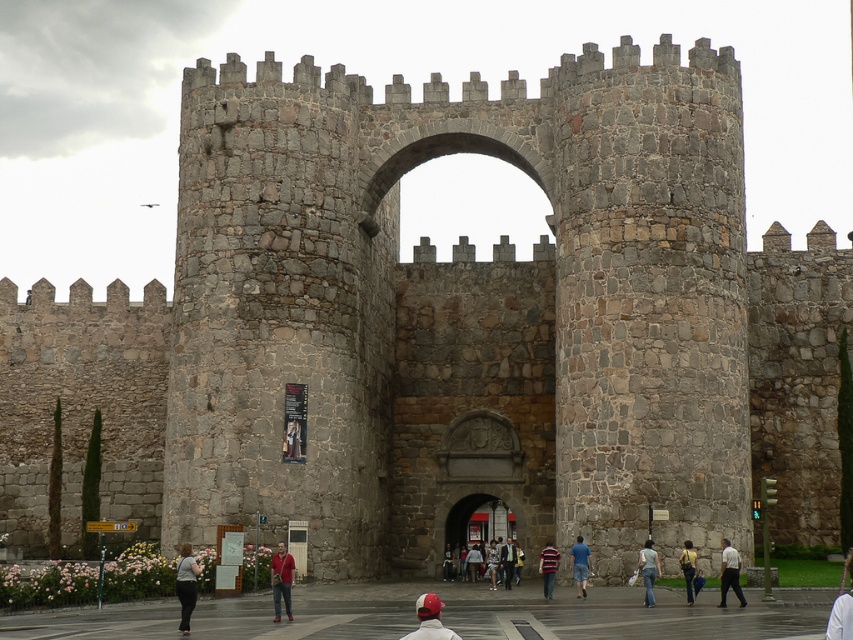
You are an artist sketching the historic stone archway. You notice a person wearing a matte red shirt at center and a dark gray stone person at center in the scene. Which of the two is shorter?

The matte red shirt at center is not as tall as dark gray stone person at center, so the matte red shirt at center is shorter.